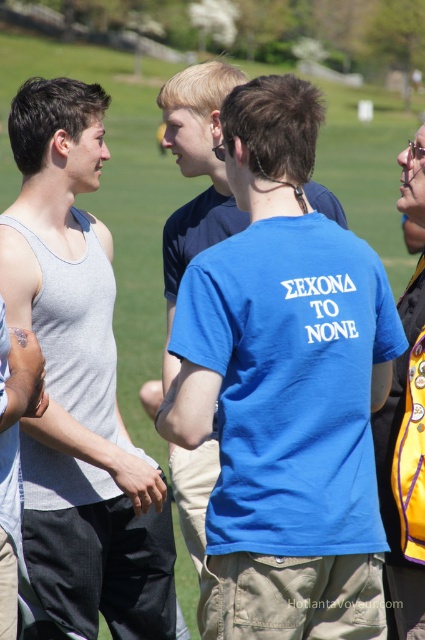
This screenshot has height=640, width=425. What do you see at coordinates (79, 384) in the screenshot? I see `gray matte tank top at left` at bounding box center [79, 384].

Who is positioned more to the left, gray matte tank top at left or yellow fabric backpack at right?

gray matte tank top at left

Where is `gray matte tank top at left`? gray matte tank top at left is located at coordinates (79, 384).

You are a GUI agent. You are given a task and a screenshot of the screen. Output one action in this format:
    pyautogui.click(x=<x>, y=<y>)
    Task: Click on the gray matte tank top at left
    The image size is (425, 640).
    Given the screenshot: What is the action you would take?
    pyautogui.click(x=79, y=384)